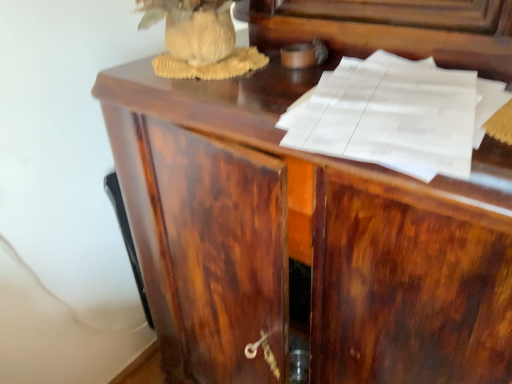
Measure the distance between point (443, 163) and camera.

A distance of 18.39 inches exists between point (443, 163) and camera.

What do you see at coordinates (390, 116) in the screenshot? This screenshot has width=512, height=384. I see `white paper at upper right` at bounding box center [390, 116].

Image resolution: width=512 pixels, height=384 pixels. Find the location of `white paper at upper right`. white paper at upper right is located at coordinates (390, 116).

I want to click on white paper at upper right, so click(390, 116).